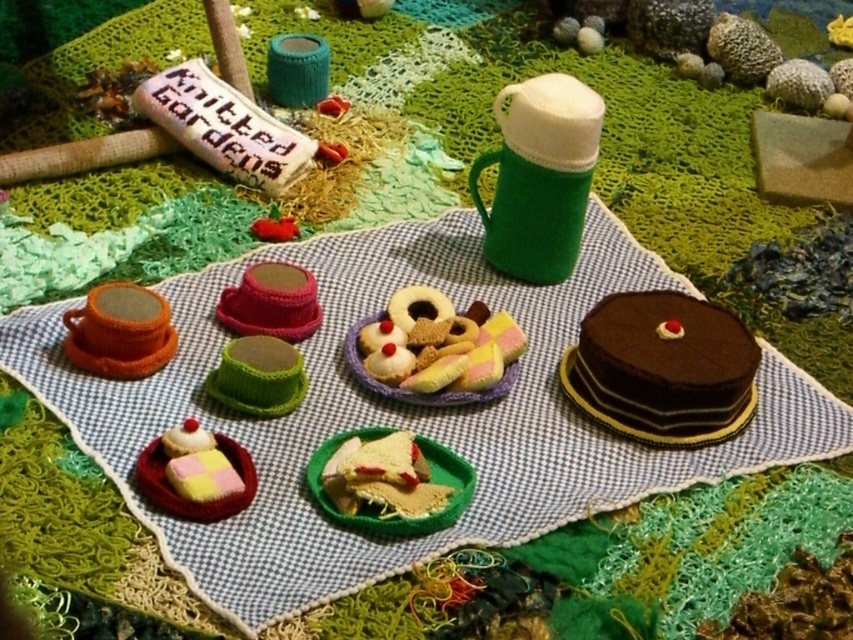
You are a tiny toy mouse exploring the picnic scene. You want to move from the chocolate matte cake at center to the pastel felt cookies at center. Can you reach the cookies without leaving the picnic blanket?

The distance between the chocolate matte cake at center and the pastal felt cookies at center is 14.10 centimeters. Since the picnic blanket is the entire setup and the items are on it, the mouse can move across the blanket to reach the cookies.

You are setting up a picnic and want to place both the knitted fabric picnic blanket at center and the chocolate matte cake at center on a small table. Which item should you place first to ensure the cake is visible?

You should place the chocolate matte cake at center first because the knitted fabric picnic blanket at center is taller than it, so placing the cake first will allow it to remain visible underneath the blanket.